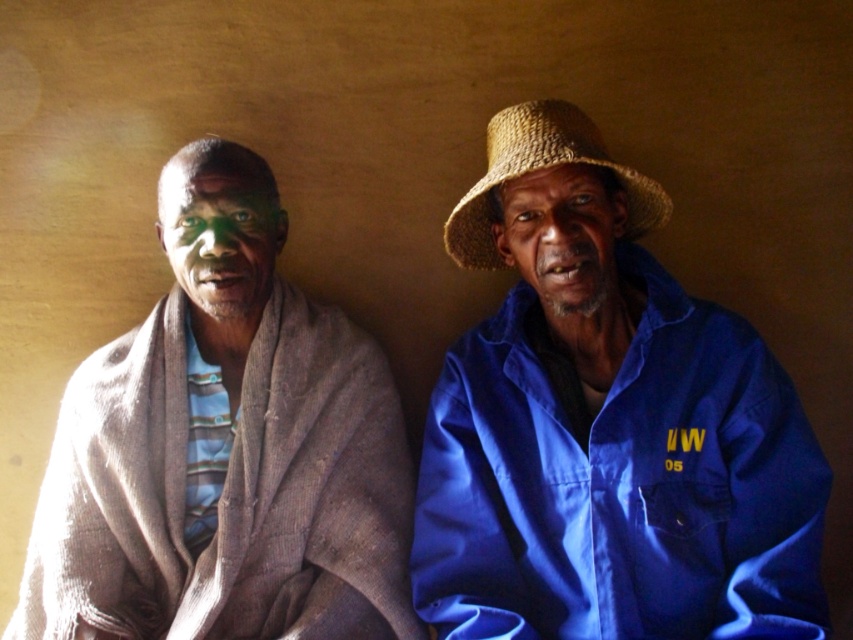
Who is shorter, brown textured blanket at left or strawmaterial/texturehat at right?

strawmaterial/texturehat at right is shorter.

Between point (142, 476) and point (595, 148), which one is positioned in front?

Point (595, 148)

Image resolution: width=853 pixels, height=640 pixels. I want to click on brown textured blanket at left, so click(x=224, y=449).

Between brown textured blanket at left and brown straw hat at upper right, which one appears on the left side from the viewer's perspective?

From the viewer's perspective, brown textured blanket at left appears more on the left side.

Can you confirm if brown textured blanket at left is smaller than brown straw hat at upper right?

No.

Is point (287, 349) positioned behind point (563, 282)?

Yes, it is.

I want to click on brown textured blanket at left, so click(224, 449).

Does blue fabric shirt at right have a smaller size compared to brown textured blanket at left?

No.

Is point (679, 420) farther from camera compared to point (114, 408)?

No, it is not.

Locate an element on the screen. This screenshot has width=853, height=640. blue fabric shirt at right is located at coordinates (606, 426).